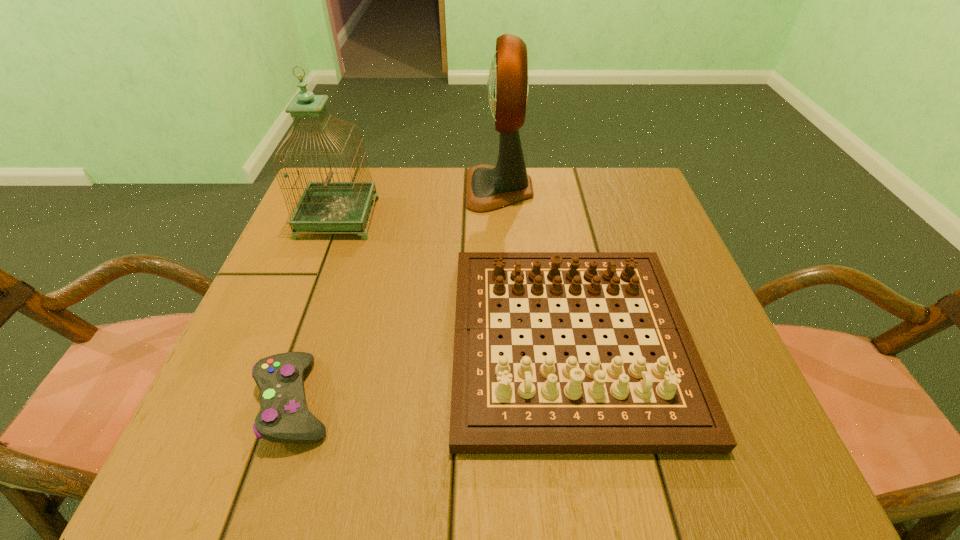
Image resolution: width=960 pixels, height=540 pixels. In the image, there is a desktop. What are the coordinates of `free region at the near edge` in the screenshot? It's located at (392, 450).

Identify the location of free region at the left edge of the desktop. (292, 251).

The image size is (960, 540). I want to click on vacant position at the right edge of the desktop, so click(719, 347).

In the image, there is a desktop. Identify the location of free space at the far right corner. This screenshot has height=540, width=960. (x=599, y=200).

The width and height of the screenshot is (960, 540). Identify the location of vacant space in between the control and the birdcage. (317, 309).

Identify the location of vacant area that lies between the gameboard and the shortest object. The width and height of the screenshot is (960, 540). pyautogui.click(x=433, y=371).

Where is `unoccupied area between the second shortest object and the control`? The width and height of the screenshot is (960, 540). unoccupied area between the second shortest object and the control is located at coordinates (433, 371).

Locate an element on the screen. Image resolution: width=960 pixels, height=540 pixels. free space between the fan and the control is located at coordinates (397, 295).

Identify the location of vacant space that is in between the birdcage and the fan. (419, 204).

Locate an element on the screen. The width and height of the screenshot is (960, 540). empty space that is in between the birdcage and the control is located at coordinates (317, 309).